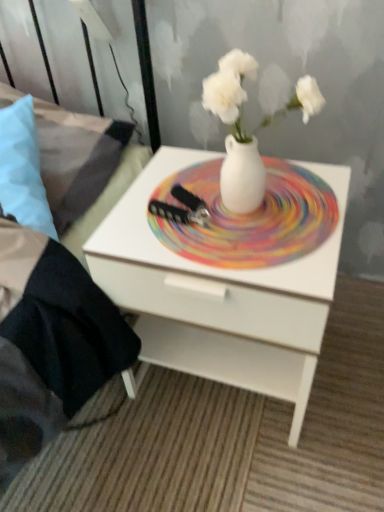
In order to click on free space that is to the left of white matte vase at center in this screenshot , I will do `click(169, 221)`.